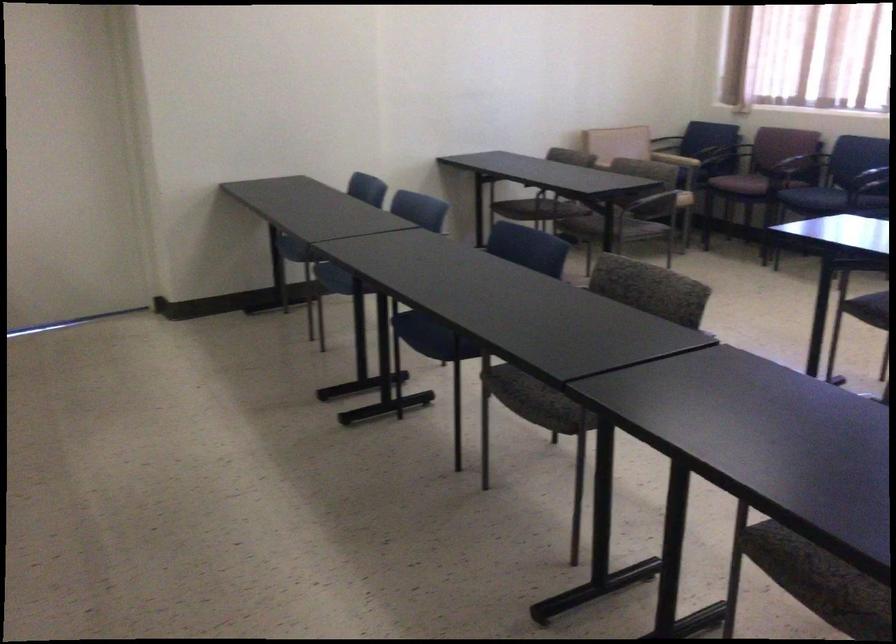
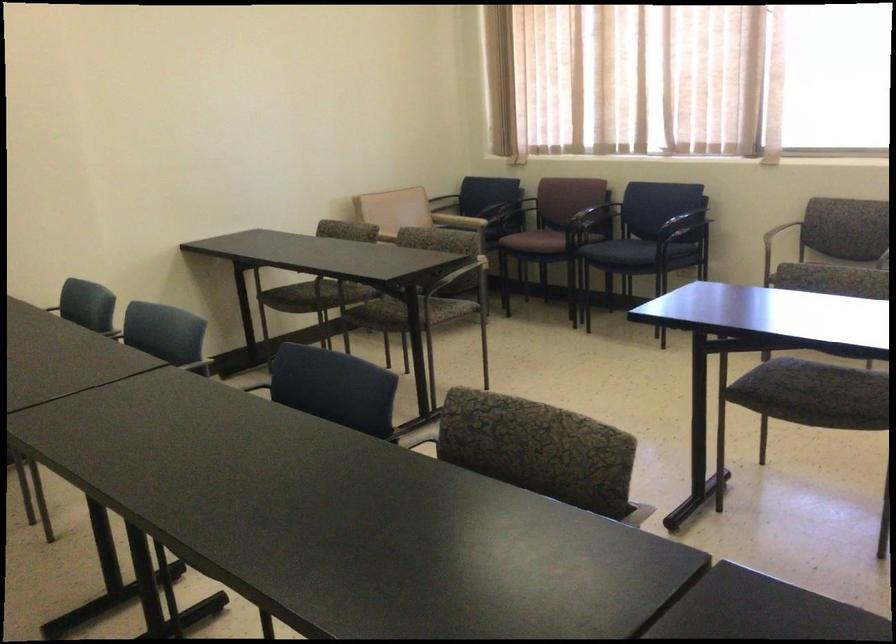
Locate, in the second image, the point that corresponds to point (605, 140) in the first image.

(381, 205)